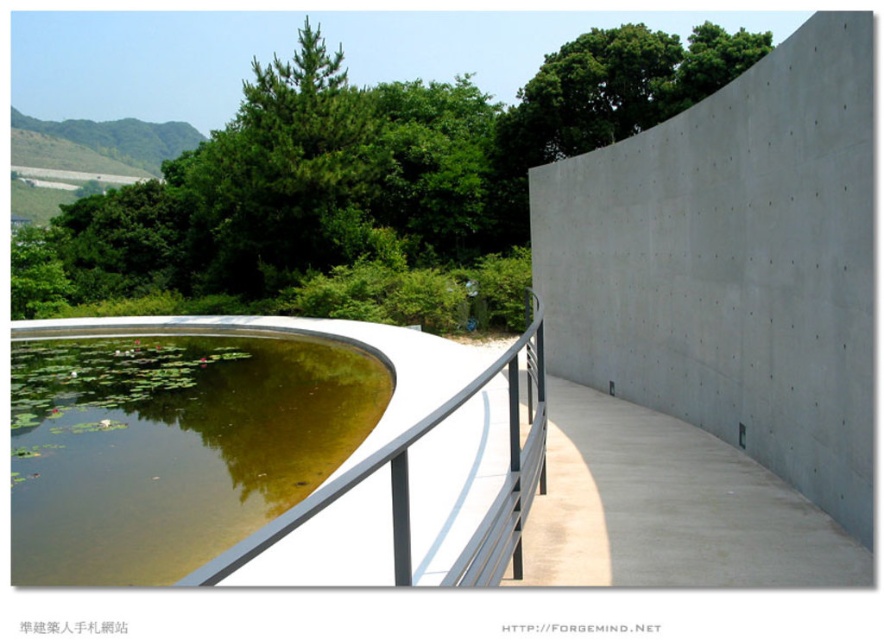
You are standing at the center of the walkway and want to take a photo of the green leafy tree at upper center. Which direction should you face to capture it in your view?

You should face towards the upper center direction to capture the green leafy tree at upper center in your view.

You are standing at the edge of the walkway and want to see both the gray concrete wall at upper right and the greenish water at center. Which object will appear higher in your field of view?

The gray concrete wall at upper right appears higher in your field of view because it is taller than the greenish water at center.

You are standing at the center of the walkway in the image. Which direction should you look to see the gray concrete wall at upper right?

The gray concrete wall at upper right is located at the upper right direction from your position at the center of the walkway.